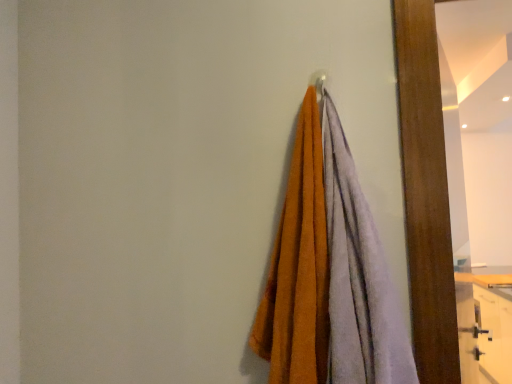
Question: From the image's perspective, is wooden mirror at right positioned above or below wooden dresser at lower right?

Choices:
 (A) above
 (B) below

Answer: (A)

Question: Considering the positions of wooden mirror at right and wooden dresser at lower right in the image, is wooden mirror at right wider or thinner than wooden dresser at lower right?

Choices:
 (A) wide
 (B) thin

Answer: (B)

Question: Which of these objects is positioned farthest from the soft cotton towels at center?

Choices:
 (A) wooden dresser at lower right
 (B) wooden mirror at right

Answer: (A)

Question: Which of these objects is positioned farthest from the wooden dresser at lower right?

Choices:
 (A) soft cotton towels at center
 (B) wooden mirror at right

Answer: (A)